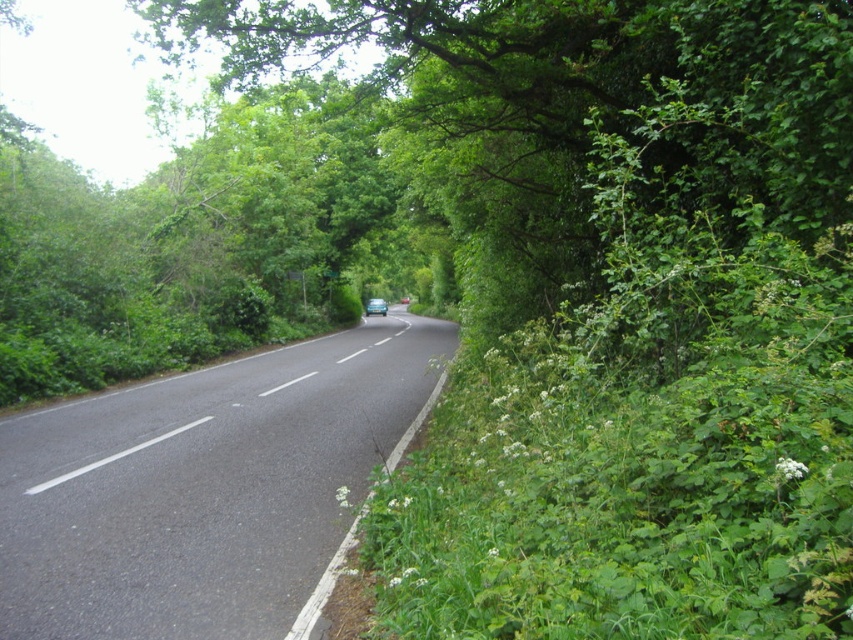
Does black asphalt road at center come in front of blue metallic car at center?

That is True.

Between point (338, 422) and point (386, 305), which one is positioned behind?

Positioned behind is point (386, 305).

Who is more forward, (85, 580) or (380, 301)?

Point (85, 580) is more forward.

In order to click on black asphalt road at center in this screenshot , I will do `click(202, 486)`.